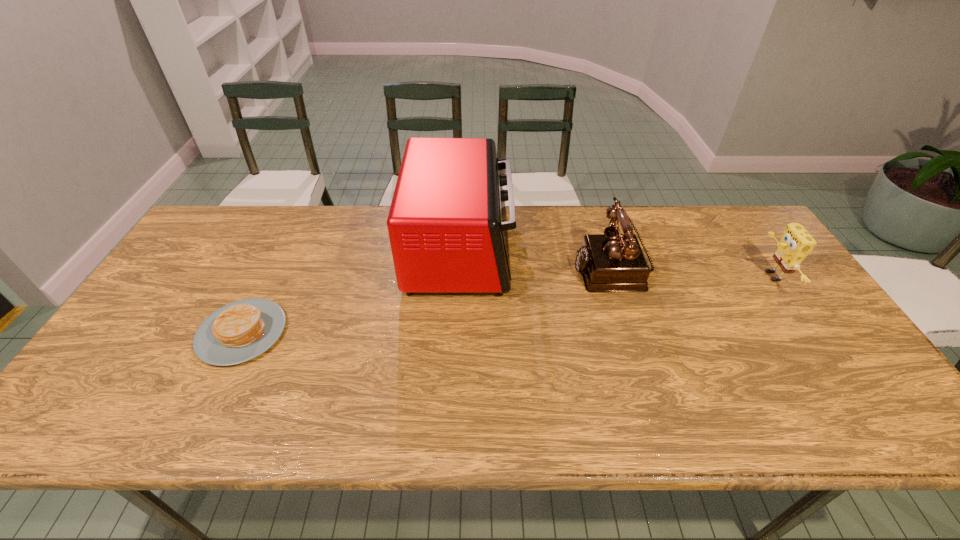
Where is `free space at the near edge of the desktop`? Image resolution: width=960 pixels, height=540 pixels. free space at the near edge of the desktop is located at coordinates (242, 429).

Find the location of a particular element. The image size is (960, 540). free space at the left edge is located at coordinates (103, 375).

You are a GUI agent. You are given a task and a screenshot of the screen. Output one action in this format:
    pyautogui.click(x=<x>, y=<y>)
    Task: Click on the vacant space at the right edge
    The height and width of the screenshot is (540, 960).
    Given the screenshot: What is the action you would take?
    pyautogui.click(x=834, y=384)

In the image, there is a desktop. Where is `vacant space at the far left corner`? vacant space at the far left corner is located at coordinates (212, 241).

You are a GUI agent. You are given a task and a screenshot of the screen. Output one action in this format:
    pyautogui.click(x=<x>, y=<y>)
    Task: Click on the free space between the pancake and the sponge
    The image size is (960, 540).
    Given the screenshot: What is the action you would take?
    pyautogui.click(x=507, y=305)

Where is `free area in between the tallest object and the second tallest object`? free area in between the tallest object and the second tallest object is located at coordinates (537, 258).

In order to click on vacant space that's between the telephone and the leftmost object in this screenshot , I will do `click(427, 300)`.

Find the location of a particular element. The image size is (960, 540). vacant space that is in between the tallest object and the third shortest object is located at coordinates [x=537, y=258].

Identify the location of free space between the toaster oven and the third object from left to right. Image resolution: width=960 pixels, height=540 pixels. (537, 258).

Where is `vacant space that's between the shortest object and the toaster oven`? vacant space that's between the shortest object and the toaster oven is located at coordinates (351, 291).